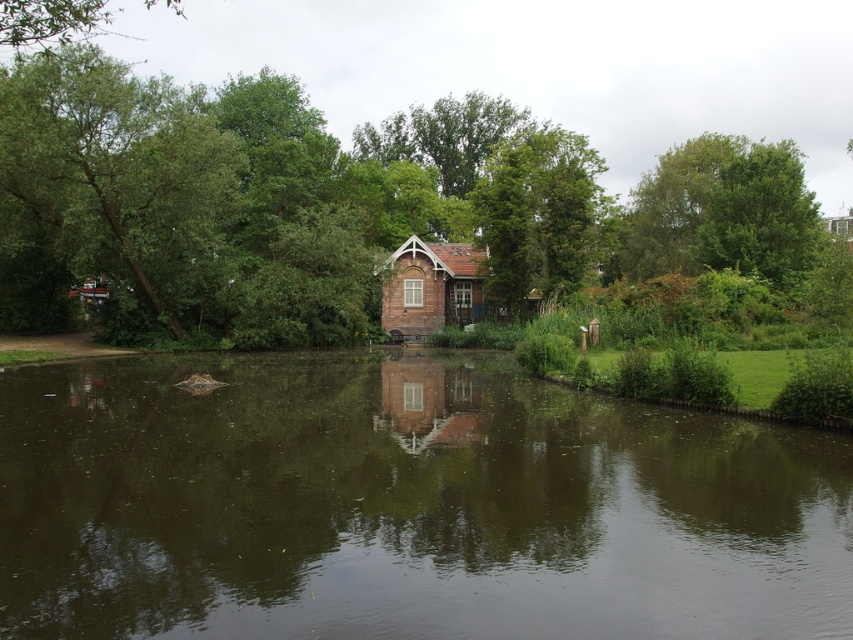
Question: Which point is closer to the camera?

Choices:
 (A) green reflective water at center
 (B) green leafy tree at center
 (C) brown brick cabin at center

Answer: (A)

Question: Can you confirm if green reflective water at center is positioned below green leafy tree at center?

Choices:
 (A) yes
 (B) no

Answer: (A)

Question: Can you confirm if green leafy tree at center is positioned to the right of brown brick cabin at center?

Choices:
 (A) no
 (B) yes

Answer: (A)

Question: Among these objects, which one is farthest from the camera?

Choices:
 (A) brown brick cabin at center
 (B) green leafy tree at left

Answer: (A)

Question: Does green reflective water at center lie behind brown brick cabin at center?

Choices:
 (A) no
 (B) yes

Answer: (A)

Question: Which of the following is the closest to the observer?

Choices:
 (A) green leafy tree at left
 (B) brown brick cabin at center
 (C) green leafy tree at center
 (D) green reflective water at center

Answer: (D)